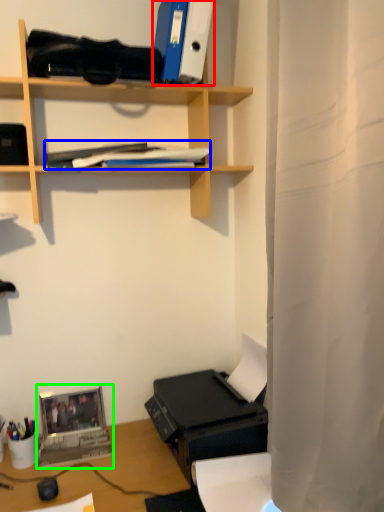
Question: Estimate the real-world distances between objects in this image. Which object is closer to paperback book (highlighted by a red box), book (highlighted by a blue box) or laptop (highlighted by a green box)?

Choices:
 (A) book
 (B) laptop

Answer: (A)